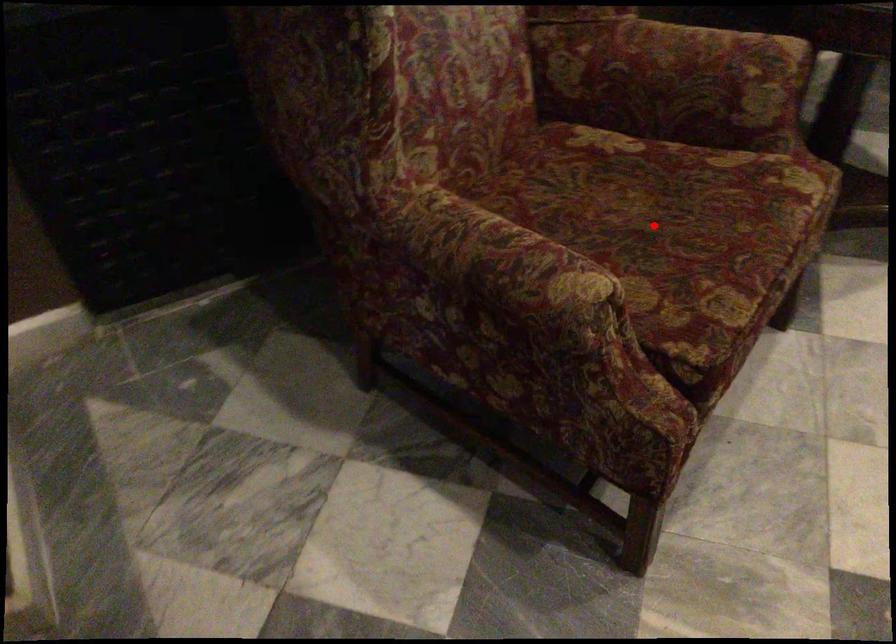
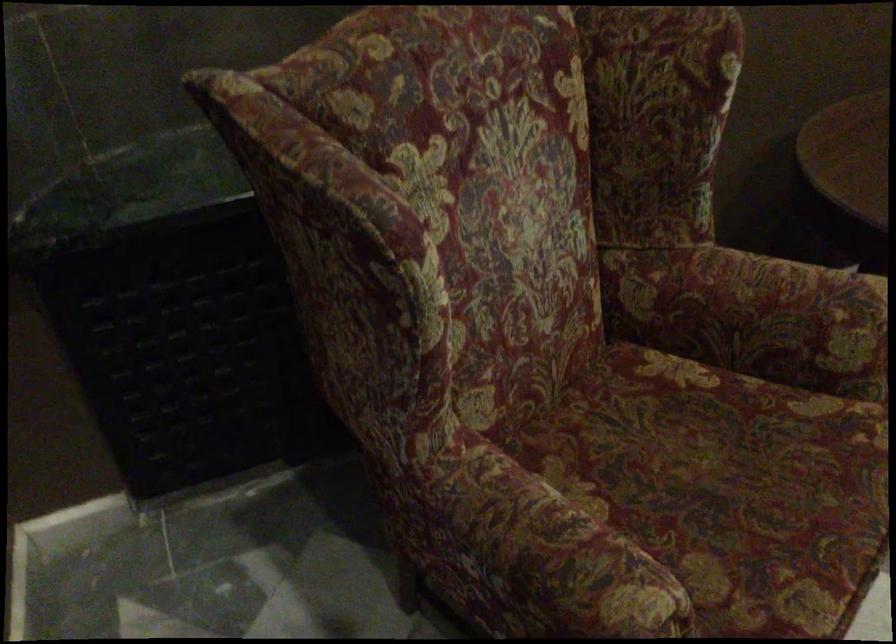
The point at the highlighted location is marked in the first image. Where is the corresponding point in the second image?

(726, 486)